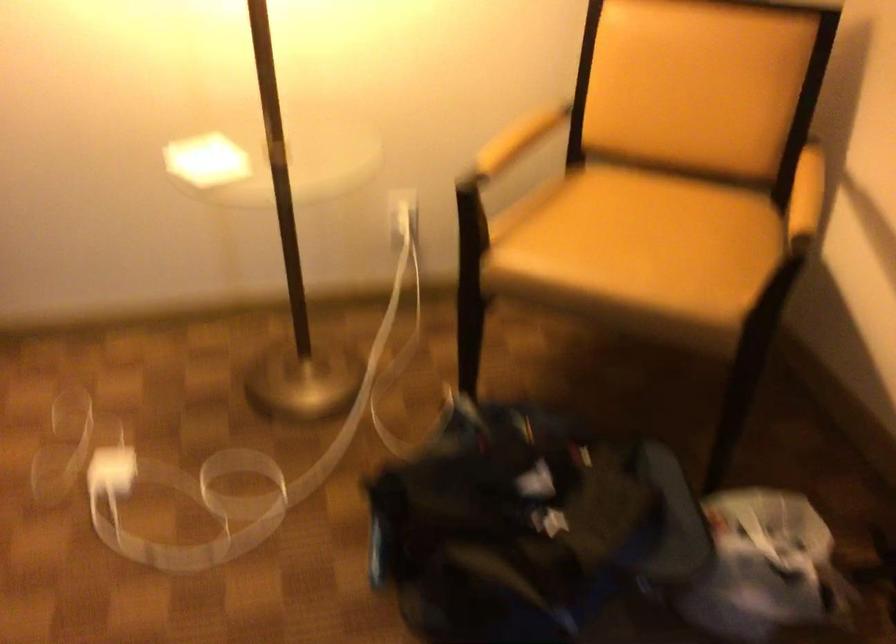
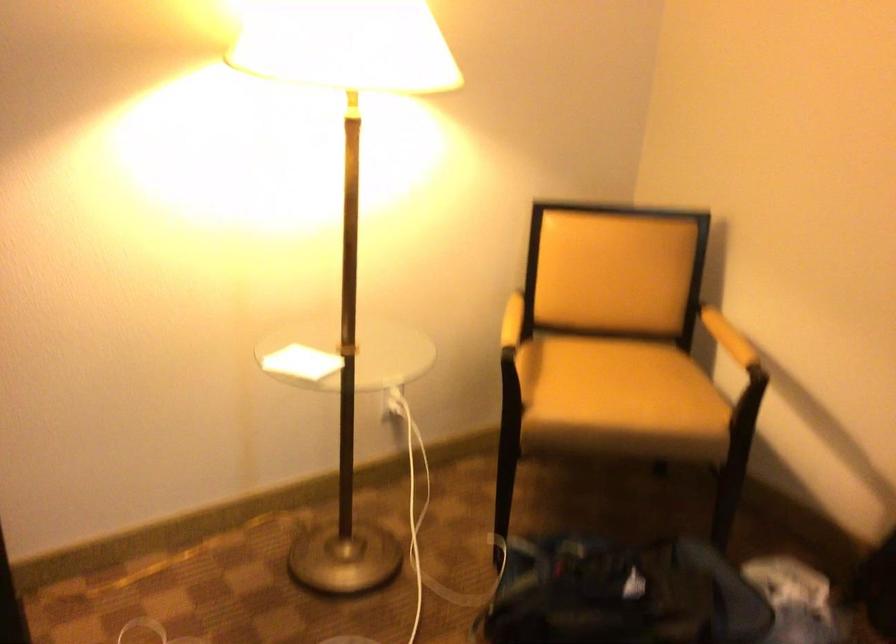
Find the pixel in the second image that matches the point at 216,154 in the first image.

(300, 363)